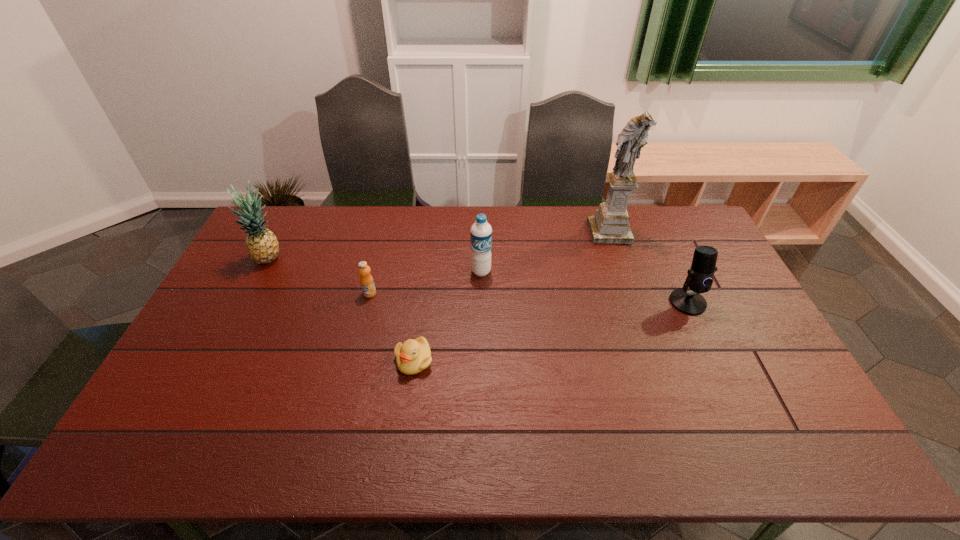
In order to click on the tallest object in this screenshot , I will do pos(610,225).

Locate an element on the screen. the second object from right to left is located at coordinates (610, 225).

The width and height of the screenshot is (960, 540). Find the location of `the leftmost object`. the leftmost object is located at coordinates (262, 245).

This screenshot has width=960, height=540. Find the location of `the fifth shortest object`. the fifth shortest object is located at coordinates (262, 245).

Find the location of `water bottle`. water bottle is located at coordinates click(x=481, y=232).

Locate an element on the screen. the rightmost object is located at coordinates (700, 276).

Image resolution: width=960 pixels, height=540 pixels. I want to click on the fifth object from right to left, so pyautogui.click(x=367, y=283).

At what (x,y) coordinates should I click in order to perform the action: click on orange juice. Please return your answer as a coordinate pair (x, y). Looking at the image, I should click on (367, 283).

I want to click on duckling, so tap(413, 356).

Where is `the shortest object`? The image size is (960, 540). the shortest object is located at coordinates (413, 356).